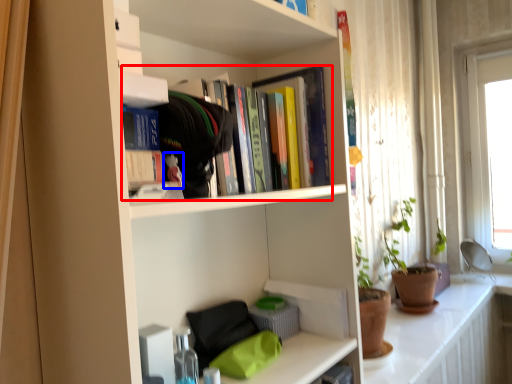
Question: Which of the following is the closest to the observer, book (highlighted by a red box) or toy (highlighted by a blue box)?

Choices:
 (A) book
 (B) toy

Answer: (B)